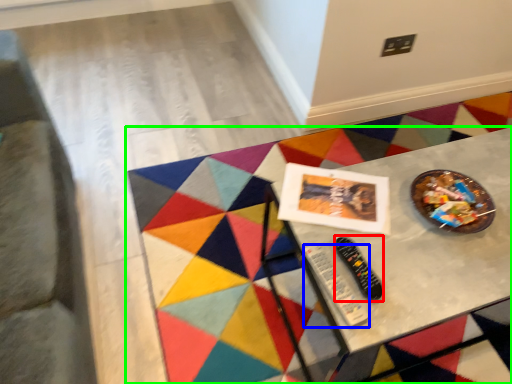
Question: Which object is the closest to the control (highlighted by a red box)? Choose among these: control (highlighted by a blue box) or table (highlighted by a green box).

Choices:
 (A) control
 (B) table

Answer: (A)